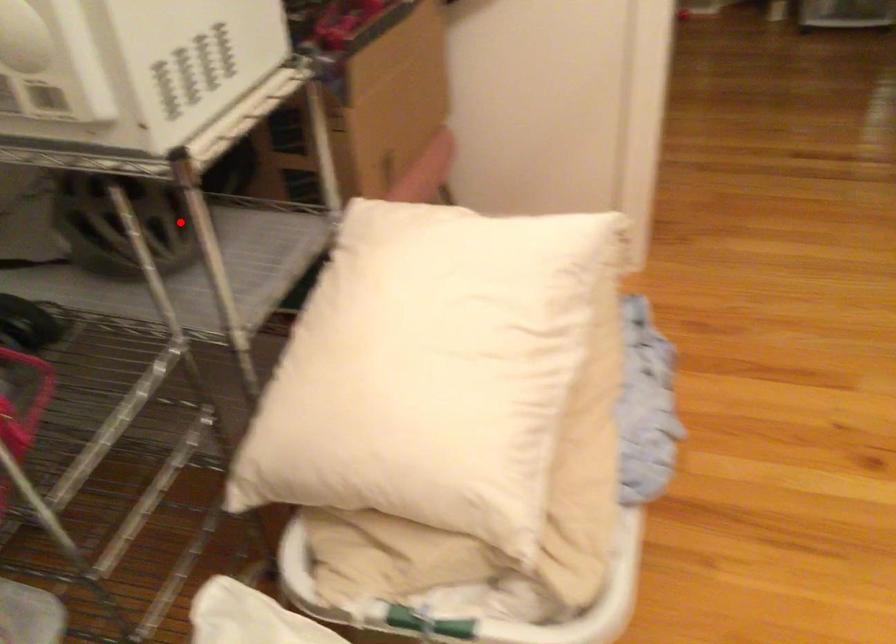
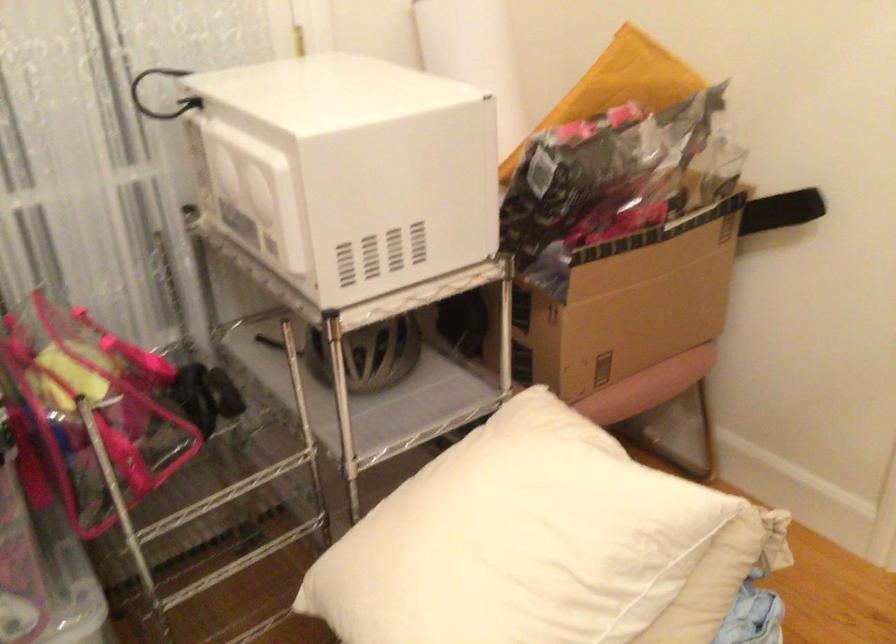
Where in the second image is the point corresponding to the highlighted location from the first image?

(375, 355)